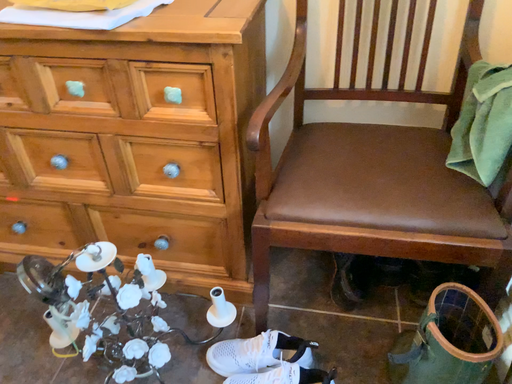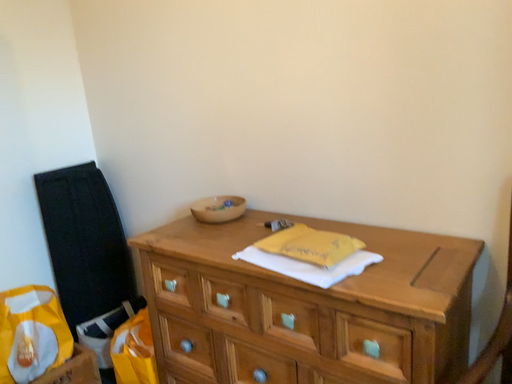
Question: Which way did the camera rotate in the video?

Choices:
 (A) rotated upward
 (B) rotated downward

Answer: (A)